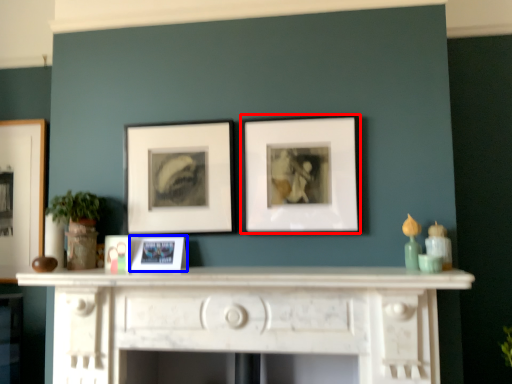
Question: Which of the following is the closest to the observer, picture frame (highlighted by a red box) or picture frame (highlighted by a blue box)?

Choices:
 (A) picture frame
 (B) picture frame

Answer: (A)